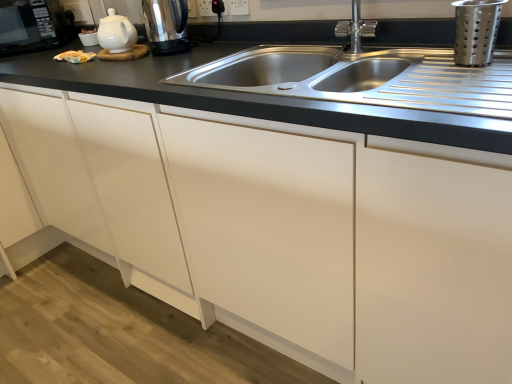
This screenshot has width=512, height=384. In order to click on vacant area situated below white glossy teapot at upper left (from a real-world perspective) in this screenshot , I will do coord(123,52).